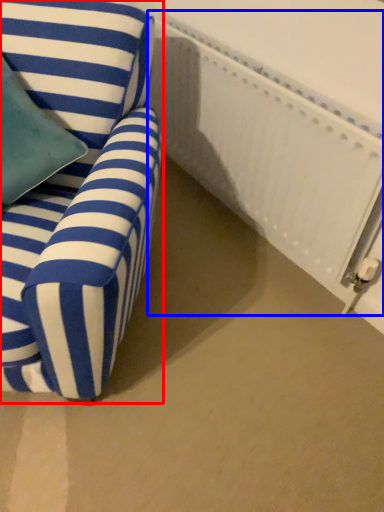
Question: Which of the following is the closest to the observer, chair (highlighted by a red box) or radiator (highlighted by a blue box)?

Choices:
 (A) chair
 (B) radiator

Answer: (A)